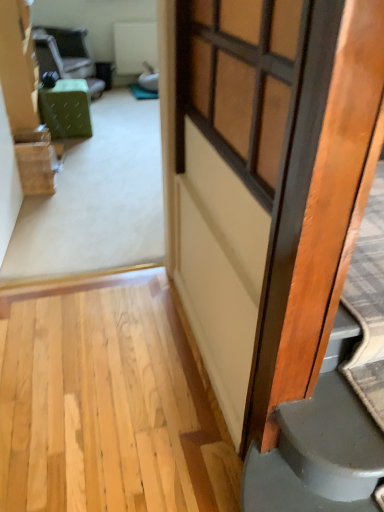
The height and width of the screenshot is (512, 384). What do you see at coordinates (239, 82) in the screenshot? I see `matte wooden window at center` at bounding box center [239, 82].

The image size is (384, 512). What do you see at coordinates (66, 109) in the screenshot?
I see `green fabric ottoman at center` at bounding box center [66, 109].

What do you see at coordinates (331, 407) in the screenshot? Image resolution: width=384 pixels, height=512 pixels. I see `wooden door at right` at bounding box center [331, 407].

Identify the location of matte wooden window at center. The width and height of the screenshot is (384, 512). (239, 82).

Is wooden door at right far away from green fabric ottoman at center?

That's right, there is a large distance between wooden door at right and green fabric ottoman at center.

Between wooden door at right and green fabric ottoman at center, which one appears on the right side from the viewer's perspective?

wooden door at right.

From a real-world perspective, which object stands above the other?

From a 3D spatial view, wooden door at right is above.

Considering the relative sizes of wooden door at right and green fabric ottoman at center in the image provided, is wooden door at right wider than green fabric ottoman at center?

Correct, the width of wooden door at right exceeds that of green fabric ottoman at center.

Is wooden door at right taller than wooden door at right?

No.

From the image's perspective, who appears lower, wooden door at right or wooden door at right?

wooden door at right appears lower in the image.

Considering the relative positions of wooden door at right and wooden door at right in the image provided, is wooden door at right in front of wooden door at right?

No, it is not.

In the scene shown: How distant is green fabric chair at upper left from wooden door at right?

green fabric chair at upper left and wooden door at right are 3.43 meters apart from each other.

From the image's perspective, who appears lower, green fabric chair at upper left or wooden door at right?

wooden door at right.

Which of these two, green fabric chair at upper left or wooden door at right, is bigger?

Bigger between the two is green fabric chair at upper left.

Is green fabric chair at upper left aimed at wooden door at right?

No, green fabric chair at upper left is not turned towards wooden door at right.

Is wooden door at right bigger than green fabric chair at upper left?

No, wooden door at right is not bigger than green fabric chair at upper left.

Are wooden door at right and green fabric chair at upper left far apart?

Yes.

Considering the positions of objects wooden door at right and green fabric chair at upper left in the image provided, who is behind, wooden door at right or green fabric chair at upper left?

green fabric chair at upper left is more distant.

Is wooden door at right not close to matte wooden window at center?

wooden door at right is actually quite close to matte wooden window at center.

From a real-world perspective, is wooden door at right physically located above or below matte wooden window at center?

wooden door at right is situated lower than matte wooden window at center in the real world.

Looking at this image, is wooden door at right bigger or smaller than matte wooden window at center?

wooden door at right is bigger than matte wooden window at center.

Which point is more forward, (276, 458) or (241, 16)?

The point (241, 16) is closer.

From a real-world perspective, is green fabric chair at upper left below green fabric ottoman at center?

No.

Considering the relative sizes of green fabric chair at upper left and green fabric ottoman at center in the image provided, is green fabric chair at upper left smaller than green fabric ottoman at center?

Incorrect, green fabric chair at upper left is not smaller in size than green fabric ottoman at center.

Is the position of green fabric chair at upper left less distant than that of green fabric ottoman at center?

No, the depth of green fabric chair at upper left is greater than that of green fabric ottoman at center.

Is green fabric chair at upper left looking in the opposite direction of green fabric ottoman at center?

That's not correct — green fabric chair at upper left is not looking away from green fabric ottoman at center.

Is there a large distance between green fabric chair at upper left and wooden door at right?

Absolutely, green fabric chair at upper left is distant from wooden door at right.

Considering the relative sizes of green fabric chair at upper left and wooden door at right in the image provided, is green fabric chair at upper left thinner than wooden door at right?

Indeed, green fabric chair at upper left has a lesser width compared to wooden door at right.

How many degrees apart are the facing directions of green fabric chair at upper left and wooden door at right?

There is a 54.7-degree angle between the facing directions of green fabric chair at upper left and wooden door at right.

Which object is more forward, green fabric chair at upper left or wooden door at right?

wooden door at right is in front.

Find the location of a particular element. Image resolution: width=384 pixels, height=512 pixels. furniture on the left side of wooden door at right is located at coordinates (66, 109).

Locate an element on the screen. stairwell directly beneath the wooden door at right (from a real-world perspective) is located at coordinates (331, 407).

Considering their positions, is green fabric ottoman at center positioned further to green fabric chair at upper left than matte wooden window at center?

matte wooden window at center lies further to green fabric chair at upper left than the other object.

When comparing their distances from green fabric ottoman at center, does matte wooden window at center or wooden door at right seem further?

wooden door at right.

Considering their positions, is wooden door at right positioned further to green fabric chair at upper left than wooden door at right?

Based on the image, wooden door at right appears to be further to green fabric chair at upper left.

Based on the photo, when comparing their distances from green fabric ottoman at center, does wooden door at right or green fabric chair at upper left seem closer?

green fabric chair at upper left is positioned closer to the anchor green fabric ottoman at center.

When comparing their distances from matte wooden window at center, does wooden door at right or green fabric ottoman at center seem further?

green fabric ottoman at center is positioned further to the anchor matte wooden window at center.

Based on their spatial positions, is matte wooden window at center or wooden door at right further from green fabric ottoman at center?

wooden door at right is further to green fabric ottoman at center.

Based on their spatial positions, is green fabric ottoman at center or wooden door at right further from green fabric chair at upper left?

wooden door at right is positioned further to the anchor green fabric chair at upper left.

When comparing their distances from green fabric chair at upper left, does wooden door at right or matte wooden window at center seem closer?

matte wooden window at center.

The height and width of the screenshot is (512, 384). I want to click on furniture positioned between wooden door at right and green fabric chair at upper left from near to far, so click(66, 109).

This screenshot has width=384, height=512. Find the location of `furniture located between matte wooden window at center and green fabric chair at upper left in the depth direction`. furniture located between matte wooden window at center and green fabric chair at upper left in the depth direction is located at coordinates (66, 109).

At what (x,y) coordinates should I click in order to perform the action: click on window positioned between wooden door at right and green fabric chair at upper left from near to far. Please return your answer as a coordinate pair (x, y). This screenshot has height=512, width=384. Looking at the image, I should click on (239, 82).

At what (x,y) coordinates should I click in order to perform the action: click on stairwell between matte wooden window at center and green fabric chair at upper left in the front-back direction. Please return your answer as a coordinate pair (x, y). Looking at the image, I should click on (331, 407).